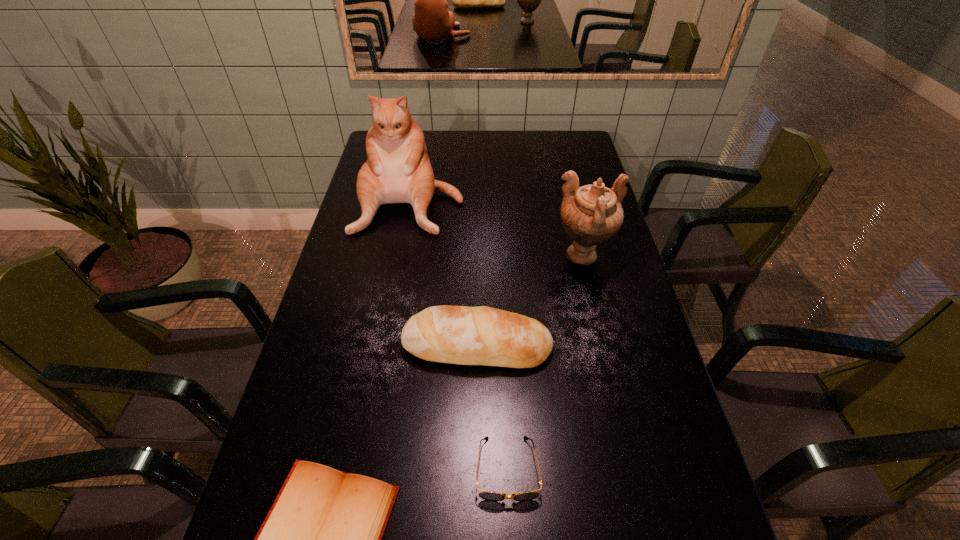
Image resolution: width=960 pixels, height=540 pixels. I want to click on unoccupied area between the farthest object and the third nearest object, so click(x=444, y=273).

I want to click on object that is the second closest to the Bible, so click(462, 335).

Locate an element on the screen. This screenshot has width=960, height=540. object identified as the second closest to the fourth tallest object is located at coordinates (462, 335).

This screenshot has height=540, width=960. I want to click on free space that satisfies the following two spatial constraints: 1. on the face of the fourth shortest object; 2. on the right side of the tallest object, so click(400, 256).

You are a GUI agent. You are given a task and a screenshot of the screen. Output one action in this format:
    pyautogui.click(x=<x>, y=<y>)
    Task: Click on the free space that satisfies the following two spatial constraints: 1. on the face of the urn; 2. on the left side of the tallest object
    
    Given the screenshot: What is the action you would take?
    pyautogui.click(x=400, y=256)

You are a GUI agent. You are given a task and a screenshot of the screen. Output one action in this format:
    pyautogui.click(x=<x>, y=<y>)
    Task: Click on the vacant space that satisfies the following two spatial constraints: 1. on the face of the farthest object; 2. on the right side of the urn
    This screenshot has width=960, height=540.
    Given the screenshot: What is the action you would take?
    pyautogui.click(x=400, y=256)